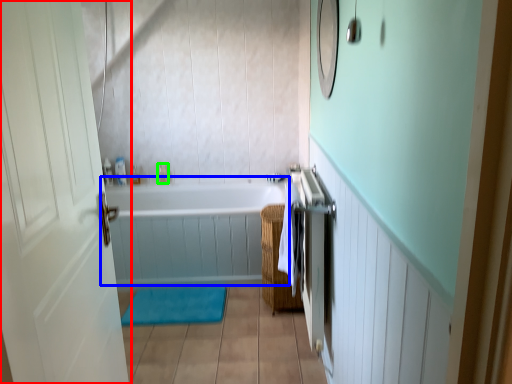
Question: Based on their relative distances, which object is farther from door (highlighted by a red box)? Choose from bathtub (highlighted by a blue box) and toiletry (highlighted by a green box).

Choices:
 (A) bathtub
 (B) toiletry

Answer: (B)